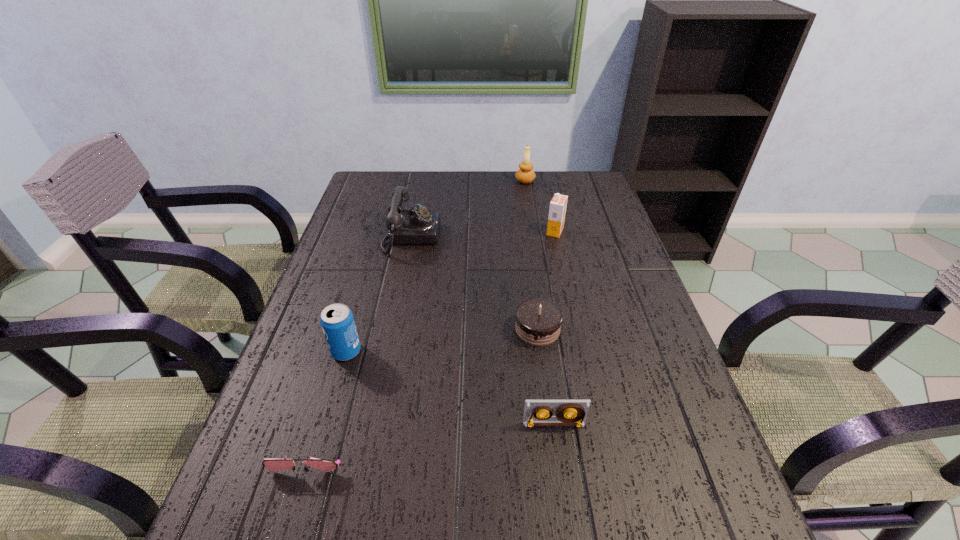
The image size is (960, 540). I want to click on free location located 0.280m on the back of the chocolate cake, so click(527, 246).

Locate an element on the screen. The image size is (960, 540). free point located 0.190m at the front of the sixth farthest object with visible reels is located at coordinates [569, 534].

Find the location of a particular element. This screenshot has height=540, width=960. object situated at the far edge is located at coordinates (525, 174).

Where is `telephone located at the left edge`? telephone located at the left edge is located at coordinates (417, 226).

Find the location of a particular element. Image resolution: width=960 pixels, height=540 pixels. soda can present at the left edge is located at coordinates (337, 321).

Find the location of a particular element. Image resolution: width=960 pixels, height=540 pixels. free region at the far edge is located at coordinates (465, 173).

Identify the location of vacant space at the left edge of the desktop. This screenshot has width=960, height=540. (295, 495).

At what (x,y) coordinates should I click in order to perform the action: click on free space at the right edge of the desktop. Please return your answer as a coordinate pair (x, y). Looking at the image, I should click on (605, 347).

The image size is (960, 540). I want to click on vacant area at the far left corner of the desktop, so click(x=390, y=174).

The width and height of the screenshot is (960, 540). I want to click on free spot between the candle_holder and the chocolate cake, so click(531, 255).